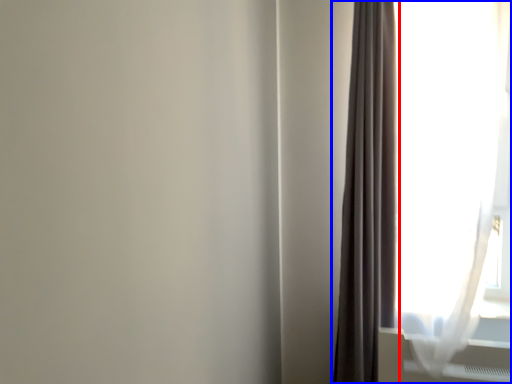
Question: Which of the following is the farthest to the observer, curtain (highlighted by a red box) or curtain (highlighted by a blue box)?

Choices:
 (A) curtain
 (B) curtain

Answer: (A)